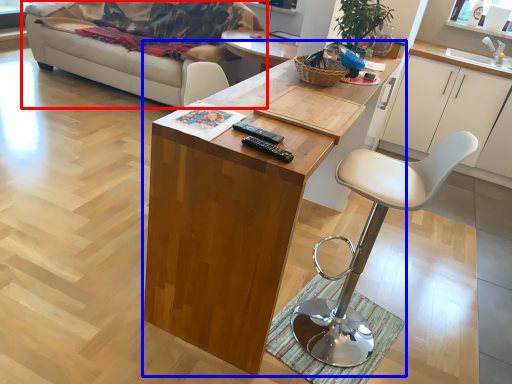
Question: Which object appears closest to the camera in this image, studio couch (highlighted by a red box) or desk (highlighted by a blue box)?

Choices:
 (A) studio couch
 (B) desk

Answer: (B)